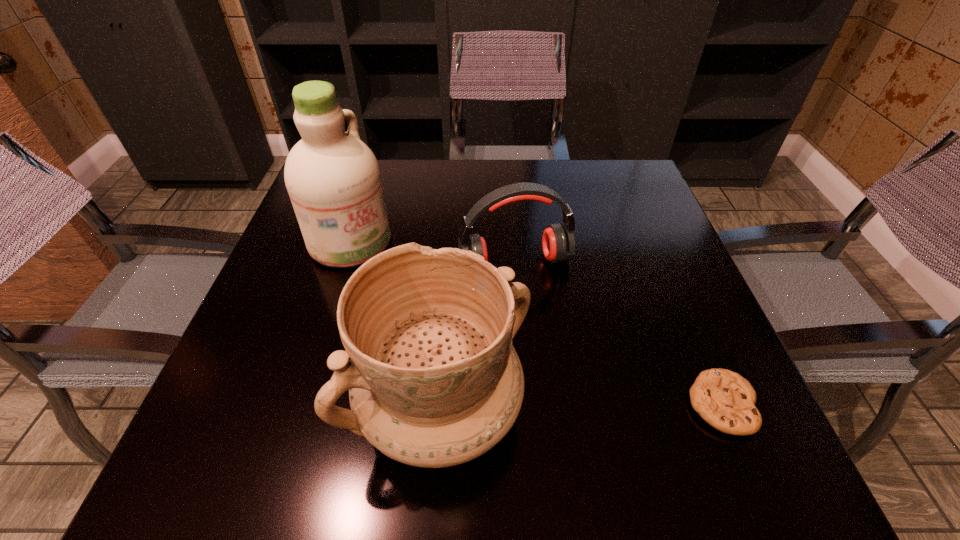
In the image, there is a desktop. Where is `blank space at the near edge`? blank space at the near edge is located at coordinates (537, 395).

Where is `blank space at the left edge of the desktop`? The image size is (960, 540). blank space at the left edge of the desktop is located at coordinates (301, 366).

In the image, there is a desktop. In order to click on vacant space at the near left corner in this screenshot , I will do `click(296, 395)`.

At what (x,y) coordinates should I click in order to perform the action: click on vacant space at the far right corner of the desktop. Please return your answer as a coordinate pair (x, y). Looking at the image, I should click on pos(607,165).

In the image, there is a desktop. Where is `free space at the near right corner`? The height and width of the screenshot is (540, 960). free space at the near right corner is located at coordinates (681, 415).

At what (x,y) coordinates should I click in order to perform the action: click on free space between the second shortest object and the shortest object. Please return your answer as a coordinate pair (x, y). This screenshot has height=540, width=960. Looking at the image, I should click on (618, 334).

Find the location of a particular element. Image resolution: width=960 pixels, height=540 pixels. empty location between the cookie and the leftmost object is located at coordinates (536, 323).

You are a GUI agent. You are given a task and a screenshot of the screen. Output one action in this format:
    pyautogui.click(x=<x>, y=<y>)
    Task: Click on the free spot between the shortest object and the leftmost object
    
    Given the screenshot: What is the action you would take?
    pyautogui.click(x=536, y=323)

Where is `empty space that is in between the shortest object and the second tallest object`? empty space that is in between the shortest object and the second tallest object is located at coordinates (582, 406).

Choose which object is the second nearest neighbor to the cleansing agent. Please provide its 2D coordinates. Your answer should be formatted as a tuple, i.e. [(x, y)], where the tuple contains the x and y coordinates of a point satisfying the conditions above.

[(434, 381)]